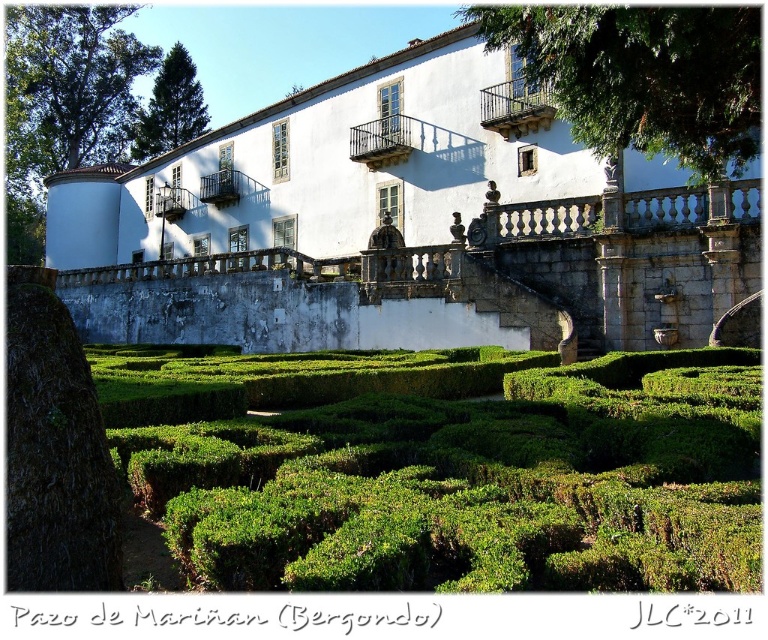
You are standing at the entrance of the garden, which is located at point 0.2,0.6. You want to walk directly towards the white stone building at center. In which direction should you move?

Since the white stone building at center is located at point (411, 220) and you are at (459, 128), you should move southeast to reach it.

You are standing at the entrance of the Pazo de Mari??an and want to take a photo that includes both the white stone building at center and the green leafy tree at upper left. If your camera has a maximum zoom range of 50 meters, will you be able to capture both in the same frame without moving closer?

The white stone building at center is 84.42 meters away from the green leafy tree at upper left, which exceeds the camera???s maximum zoom range of 50 meters. Therefore, you will not be able to capture both in the same frame without moving closer.

You are a visitor at the Pazo de Mari?n building and want to take a photo that includes both the white stone building at center and the green hedge at center. Based on their sizes, which one should you focus on to ensure both are visible in the frame?

The white stone building at center is larger than the green hedge at center, so you should focus on the white stone building at center to ensure both are visible in the frame.